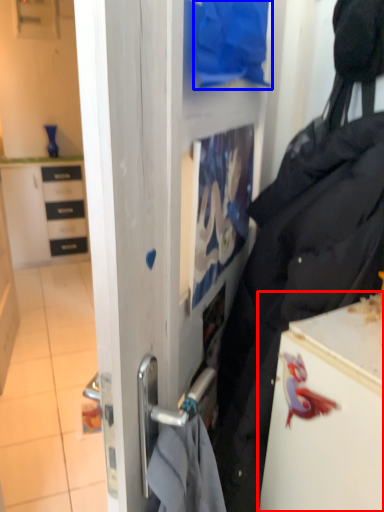
Question: Which object appears farthest to the camera in this image, fridge (highlighted by a red box) or clothing (highlighted by a blue box)?

Choices:
 (A) fridge
 (B) clothing

Answer: (B)